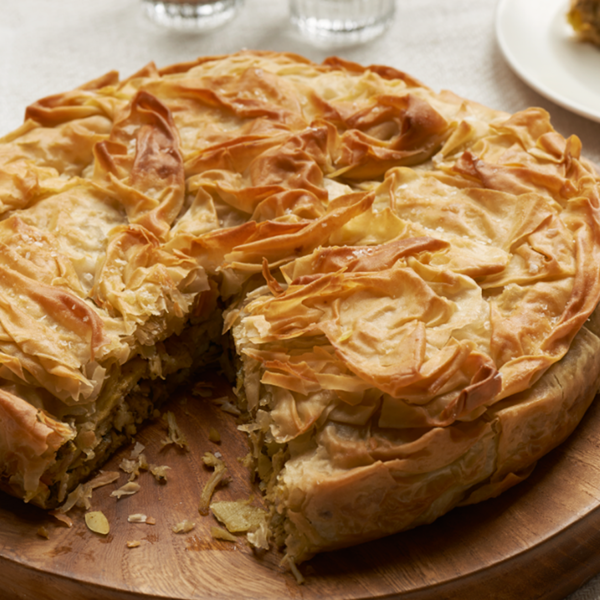
You are a GUI agent. You are given a task and a screenshot of the screen. Output one action in this format:
    pyautogui.click(x=<x>, y=<y>)
    Task: Click on the glass
    The width and height of the screenshot is (600, 600).
    Given the screenshot: What is the action you would take?
    pyautogui.click(x=349, y=18), pyautogui.click(x=194, y=12)